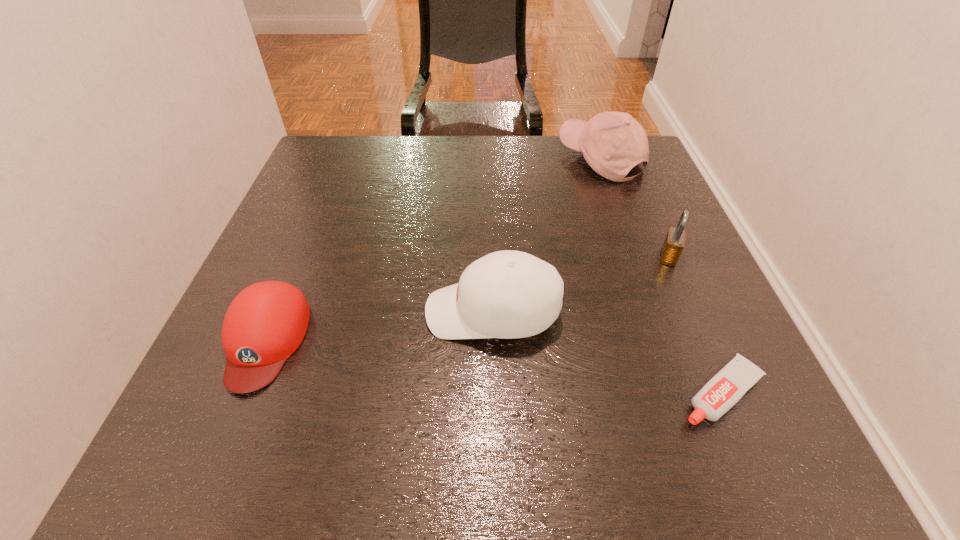
Locate an element on the screen. The width and height of the screenshot is (960, 540). padlock that is positioned at the right edge is located at coordinates pyautogui.click(x=674, y=242).

This screenshot has height=540, width=960. In order to click on toothpaste present at the right edge in this screenshot , I will do `click(727, 387)`.

Identify the location of object at the far right corner. (612, 143).

This screenshot has height=540, width=960. What are the coordinates of `object that is at the near right corner` in the screenshot? It's located at (727, 387).

In the image, there is a desktop. Where is `vacant space at the far edge`? Image resolution: width=960 pixels, height=540 pixels. vacant space at the far edge is located at coordinates coord(462,143).

This screenshot has height=540, width=960. Find the location of `vacant space at the near edge of the desktop`. vacant space at the near edge of the desktop is located at coordinates (540, 440).

The image size is (960, 540). In the image, there is a desktop. What are the coordinates of `vacant space at the left edge` in the screenshot? It's located at (314, 285).

The image size is (960, 540). Identify the location of vacant space at the right edge of the desktop. (700, 316).

Where is `free location at the far left corner of the desktop`? free location at the far left corner of the desktop is located at coordinates (319, 156).

Where is `vacant point at the near left corner`? vacant point at the near left corner is located at coordinates 219,449.